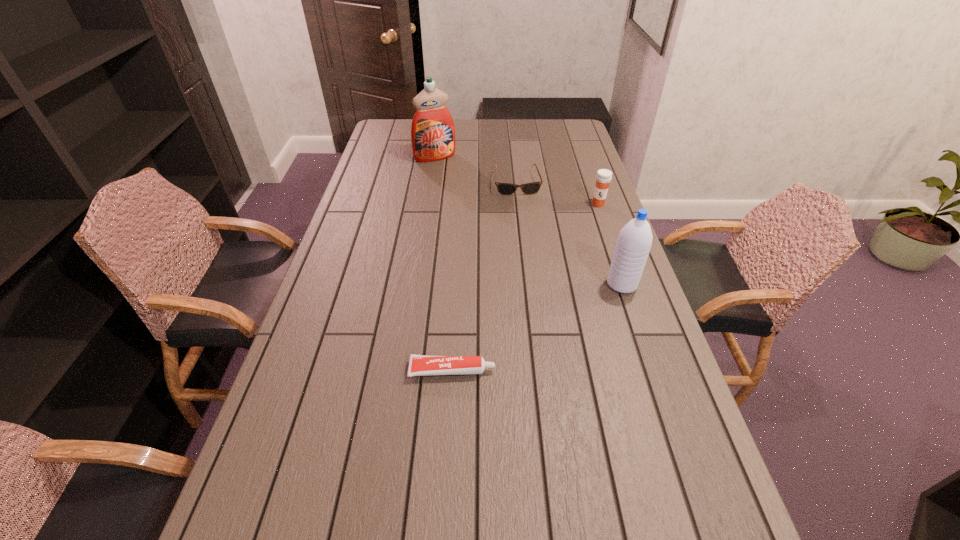
The height and width of the screenshot is (540, 960). Identify the location of vacant space located at the nozzle of the shortest object. (557, 370).

You are a GUI agent. You are given a task and a screenshot of the screen. Output one action in this format:
    pyautogui.click(x=<x>, y=<y>)
    Task: Click on the free location located on the back of the second nearest object
    The width and height of the screenshot is (960, 540).
    Given the screenshot: What is the action you would take?
    pyautogui.click(x=602, y=224)

Locate an element on the screen. free location located 0.330m on the lenses of the third object from right to left is located at coordinates (531, 253).

Where is `vacant space located on the lenses of the third object from right to left`? The image size is (960, 540). vacant space located on the lenses of the third object from right to left is located at coordinates (528, 239).

The image size is (960, 540). Identify the location of free point located 0.060m on the lenses of the third object from right to left. (521, 205).

Identify the location of vacant space situated 0.130m on the label side of the medicine. (591, 228).

Locate an element on the screen. This screenshot has width=960, height=540. vacant region located on the label side of the medicine is located at coordinates (576, 281).

What are the coordinates of `vacant space located 0.330m on the label side of the medicine` in the screenshot? It's located at (581, 266).

The image size is (960, 540). Find the location of `free space located on the front surface of the farthest object`. free space located on the front surface of the farthest object is located at coordinates (477, 211).

The image size is (960, 540). Find the location of `free region located on the front surface of the farthest object`. free region located on the front surface of the farthest object is located at coordinates (463, 191).